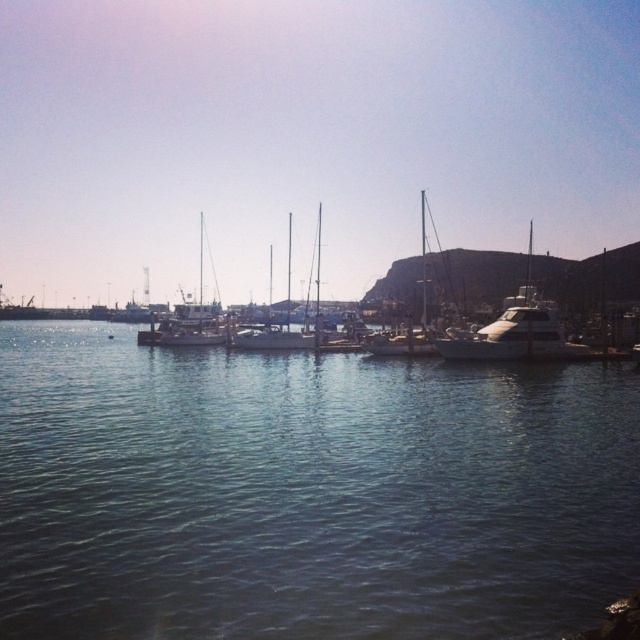
Does clear water at center have a lesser width compared to white glossy yacht at center?

Yes, clear water at center is thinner than white glossy yacht at center.

Who is more forward, (x=467, y=442) or (x=515, y=356)?

Point (x=467, y=442) is more forward.

Find the location of `clear water at center`. clear water at center is located at coordinates (307, 492).